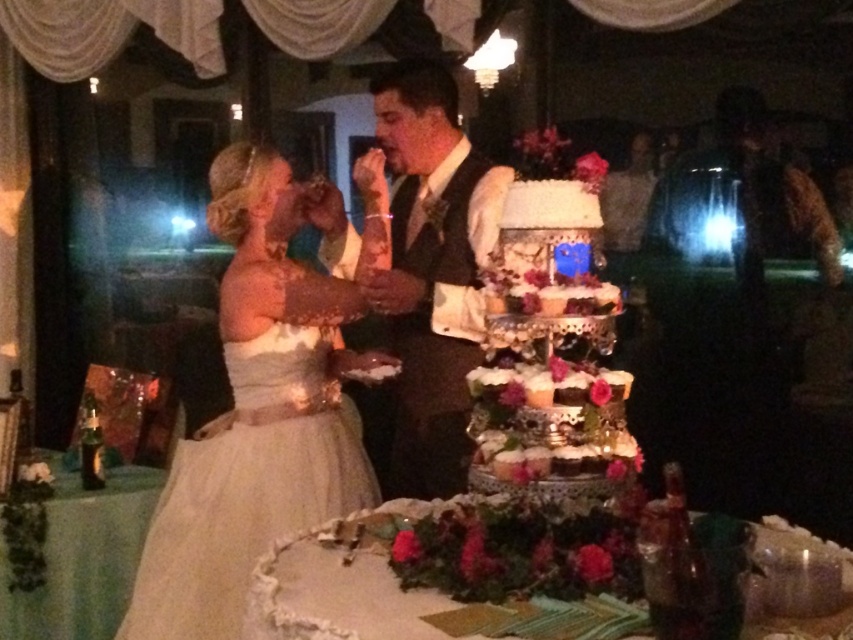
Is point (231, 342) more distant than point (471, 307)?

Yes, point (231, 342) is farther from viewer.

This screenshot has width=853, height=640. What are the coordinates of `ivory satin dress at left` in the screenshot? It's located at (x=254, y=416).